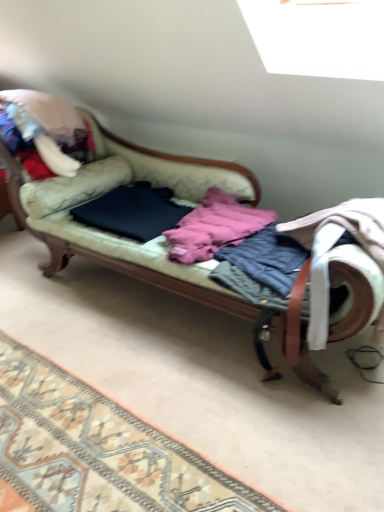
Find the location of a particular element. free point above patterned carpet at lower left (from a real-world perspective) is located at coordinates (80, 442).